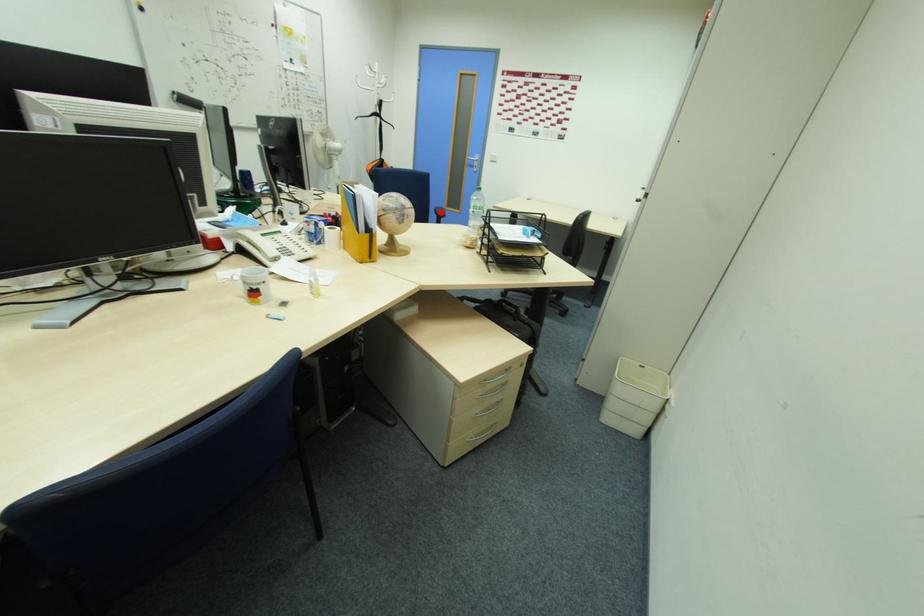
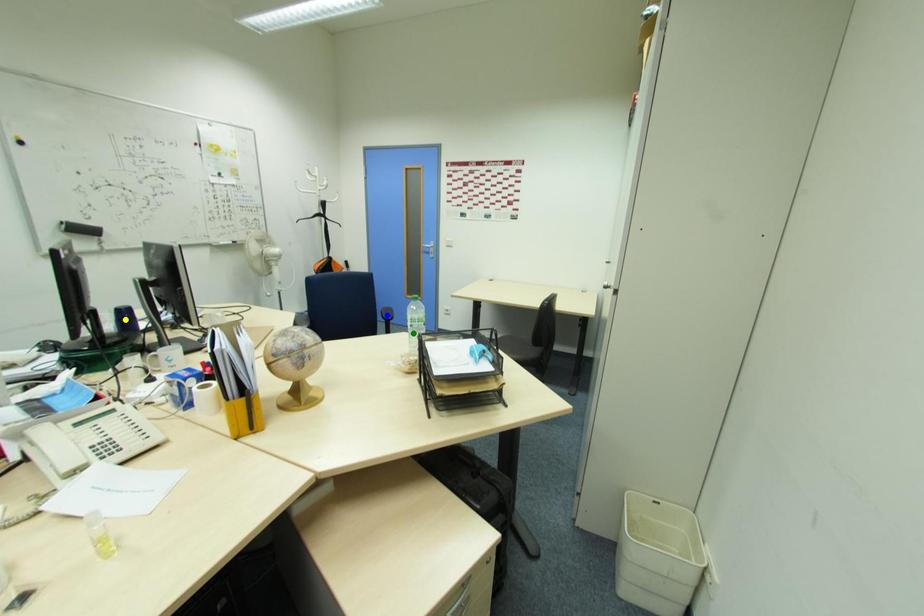
Question: I am providing you with two images of the same scene from different viewpoints. A red point is marked on the first image. You are given multiple points on the second image. Which point in image 2 represents the same 3d spot as the red point in image 1?

Choices:
 (A) blue point
 (B) yellow point
 (C) green point

Answer: (A)